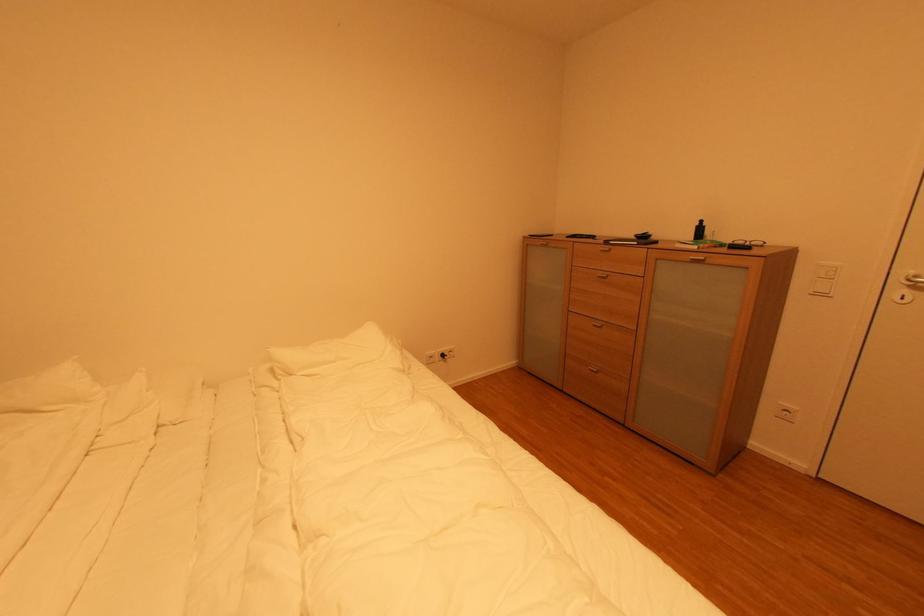
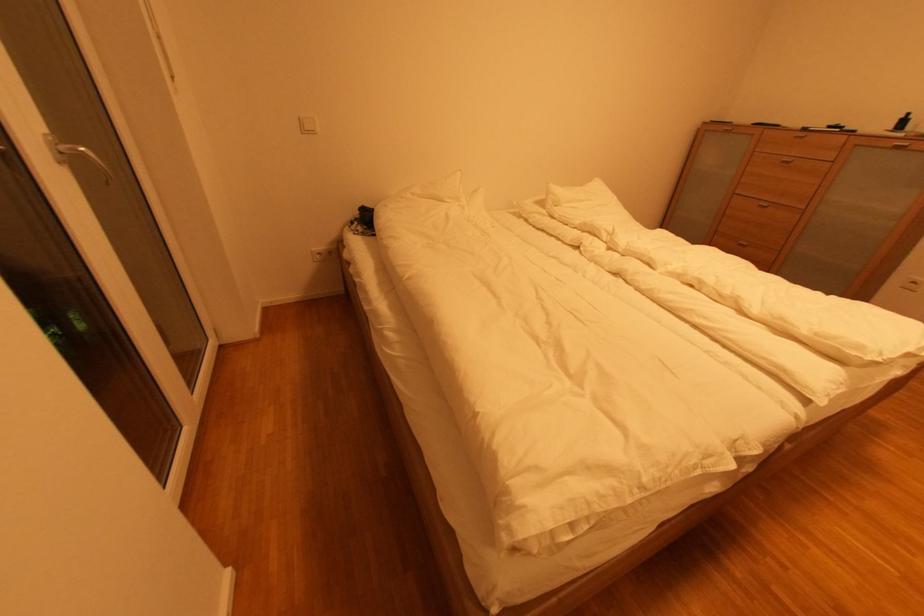
Find the pixel in the second image that matches pixel 605 329 in the first image.

(772, 208)